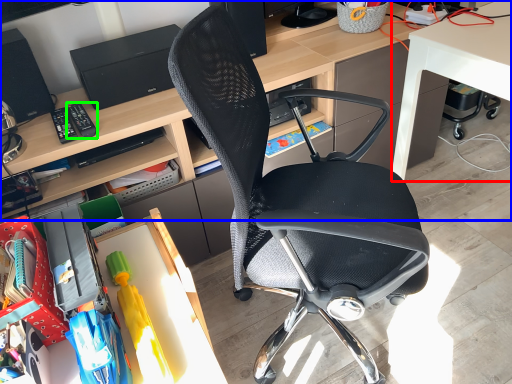
Question: Which object is the closest to the desk (highlighted by a red box)? Choose among these: desk (highlighted by a blue box) or remote control (highlighted by a green box).

Choices:
 (A) desk
 (B) remote control

Answer: (A)